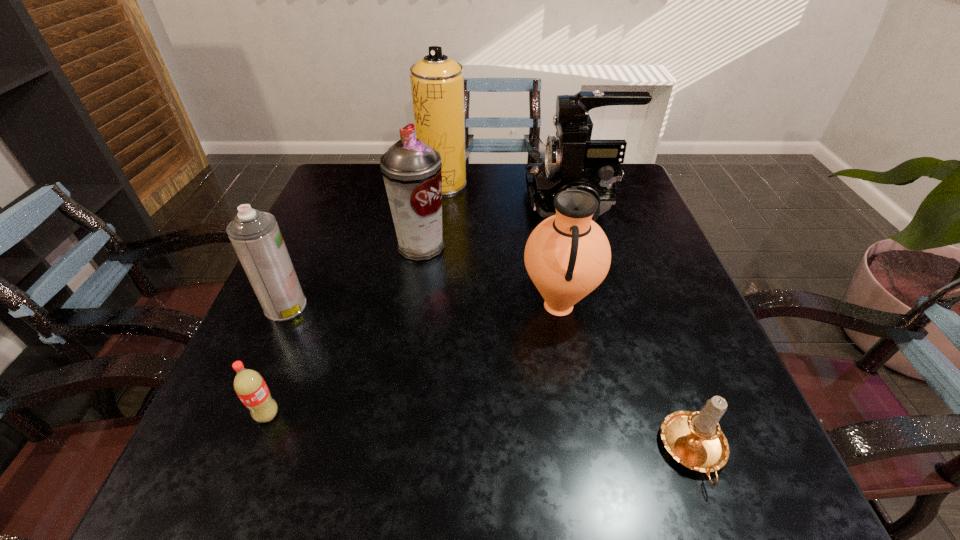
I want to click on object that is at the near edge, so click(x=694, y=439).

I want to click on aerosol can positioned at the left edge, so click(257, 240).

I want to click on soda that is at the left edge, so click(x=249, y=385).

Find the location of `camcorder that is at the right edge`. camcorder that is at the right edge is located at coordinates (571, 158).

The image size is (960, 540). I want to click on candle at the right edge, so click(694, 439).

Find the location of a particular element. object that is at the far right corner is located at coordinates (571, 158).

Where is `object at the near right corner`? object at the near right corner is located at coordinates (694, 439).

The image size is (960, 540). What are the coordinates of `vacant region at the far edge of the desktop` in the screenshot? It's located at tap(518, 191).

Find the location of `free space at the near edge of the desktop`. free space at the near edge of the desktop is located at coordinates (460, 463).

The image size is (960, 540). What are the coordinates of `free space at the left edge` in the screenshot? It's located at (305, 261).